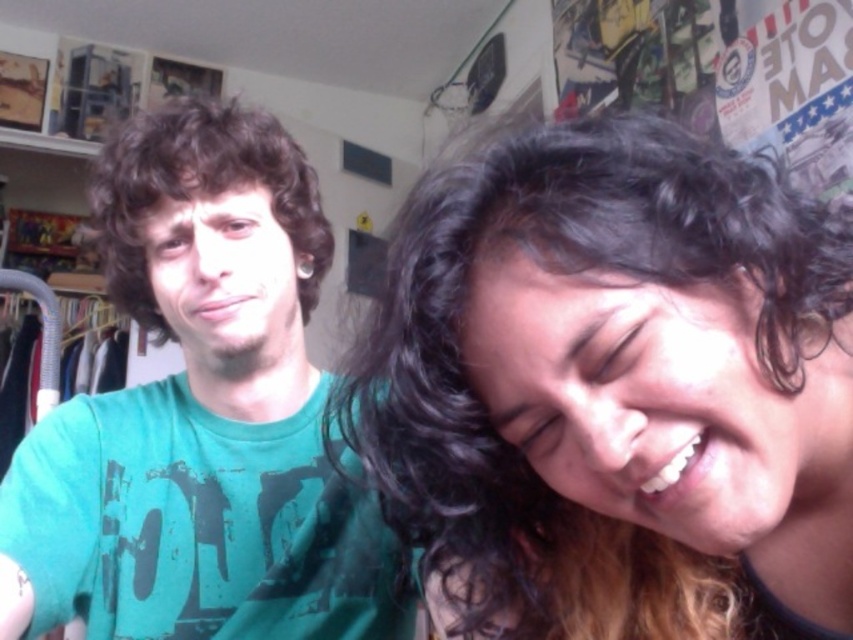
Question: Which point is farther to the camera?

Choices:
 (A) green matte t-shirt at left
 (B) dark curly hair at left

Answer: (B)

Question: Observing the image, what is the correct spatial positioning of dark brown hair at upper right in reference to dark curly hair at left?

Choices:
 (A) left
 (B) right

Answer: (B)

Question: Estimate the real-world distances between objects in this image. Which object is closer to the dark brown hair at upper right?

Choices:
 (A) dark curly hair at left
 (B) green matte t-shirt at left

Answer: (B)

Question: Can you confirm if dark brown hair at upper right is positioned below dark curly hair at left?

Choices:
 (A) no
 (B) yes

Answer: (B)

Question: Which of the following is the closest to the observer?

Choices:
 (A) (425, 291)
 (B) (386, 584)

Answer: (A)

Question: Does green matte t-shirt at left have a greater width compared to dark curly hair at left?

Choices:
 (A) no
 (B) yes

Answer: (B)